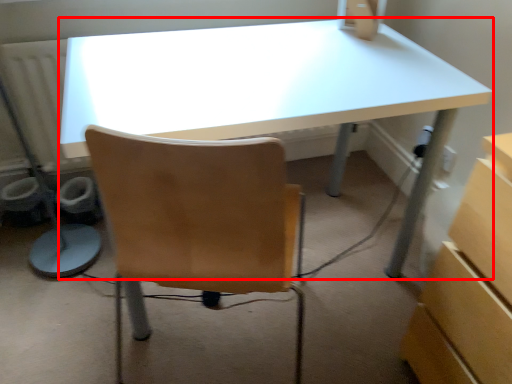
Question: From the image's perspective, where is desk (annotated by the red box) located in relation to desktop computer in the image?

Choices:
 (A) above
 (B) below

Answer: (B)